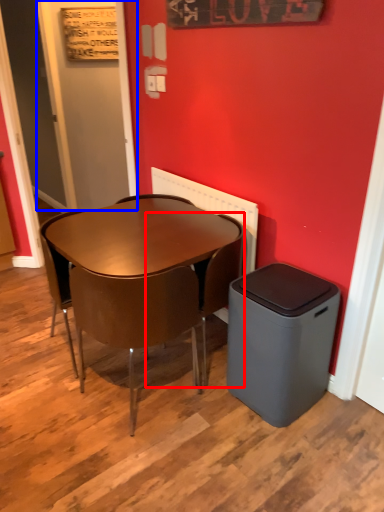
Question: Among these objects, which one is nearest to the camera, chair (highlighted by a red box) or door (highlighted by a blue box)?

Choices:
 (A) chair
 (B) door

Answer: (A)